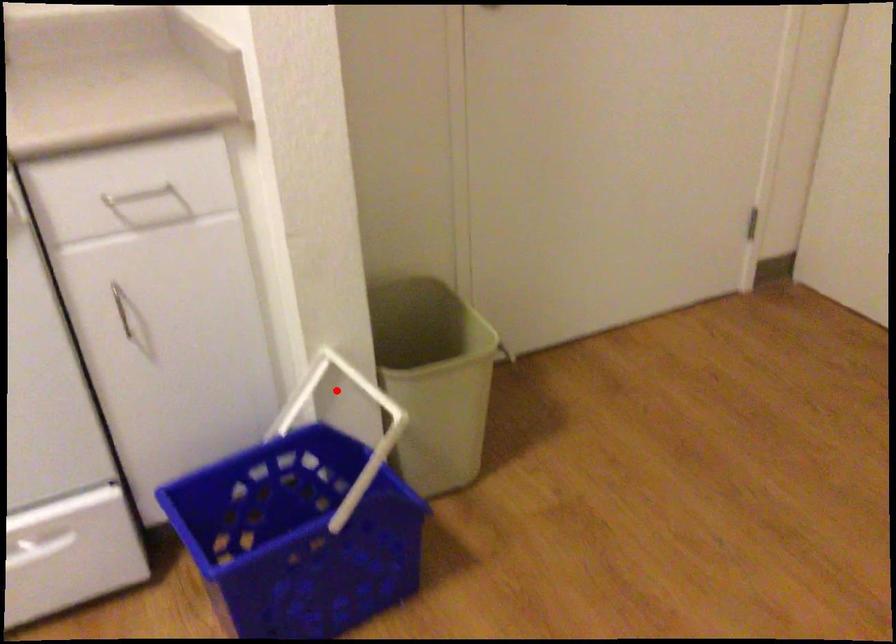
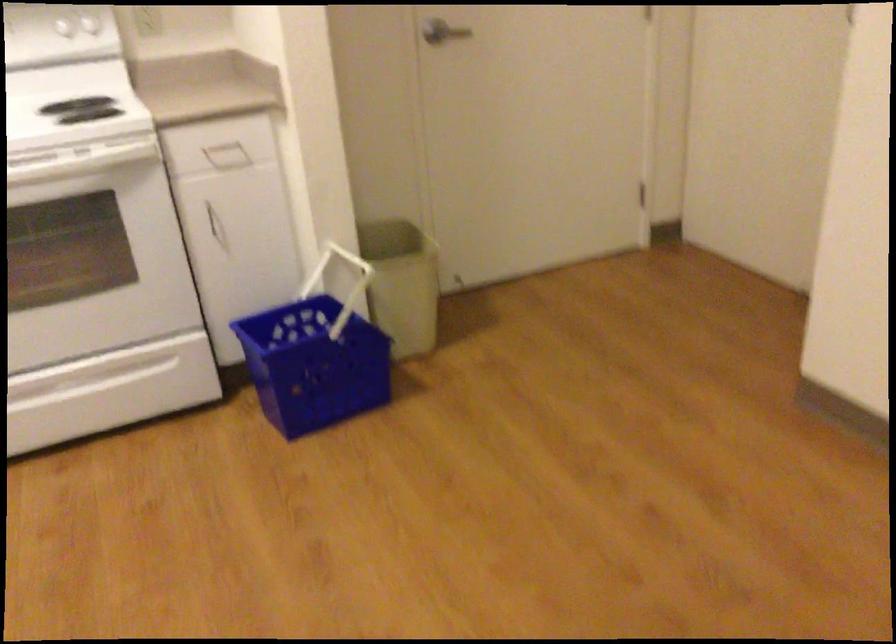
Question: I am providing you with two images of the same scene from different viewpoints. Image1 has a red point marked. In image2, the corresponding 3D location appears at what relative position? Reply with the corresponding letter.

Choices:
 (A) Closer
 (B) Farther

Answer: (B)